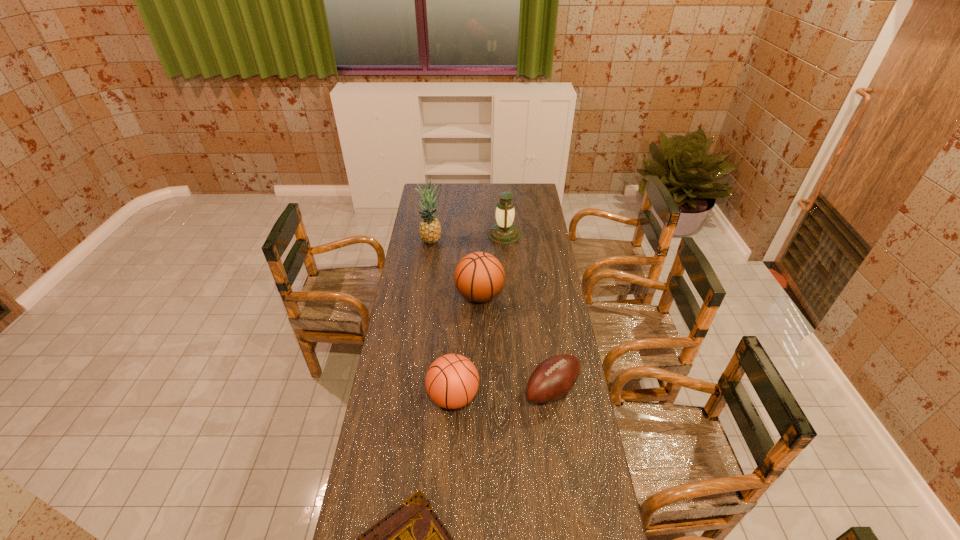
Locate an element on the screen. This screenshot has height=540, width=960. vacant point located on the right of the fourth nearest object is located at coordinates (536, 295).

You are a GUI agent. You are given a task and a screenshot of the screen. Output one action in this format:
    pyautogui.click(x=<x>, y=<y>)
    Task: Click on the vacant space located 0.100m on the back of the shorter basketball
    This screenshot has width=960, height=540.
    Given the screenshot: What is the action you would take?
    pyautogui.click(x=456, y=355)

This screenshot has width=960, height=540. Identify the location of blank space located on the back of the football (American). (541, 318).

At what (x,y) coordinates should I click in order to perform the action: click on object situated at the left edge. Please return your answer as a coordinate pair (x, y). The width and height of the screenshot is (960, 540). Looking at the image, I should click on (429, 228).

Locate an element on the screen. Image resolution: width=960 pixels, height=540 pixels. object that is at the right edge is located at coordinates (553, 378).

In the image, there is a desktop. Where is `vacant space at the far edge`? The image size is (960, 540). vacant space at the far edge is located at coordinates (511, 185).

Identify the location of blank space at the left edge. (368, 490).

Where is `blank space at the right edge`? The height and width of the screenshot is (540, 960). blank space at the right edge is located at coordinates (589, 454).

You are a GUI agent. You are given a task and a screenshot of the screen. Output one action in this format:
    pyautogui.click(x=<x>, y=<y>)
    Task: Click on the vacant position at the far right corner of the desktop
    The width and height of the screenshot is (960, 540).
    Given the screenshot: What is the action you would take?
    pyautogui.click(x=528, y=185)

Locate an element on the screen. free spot between the lantern and the shorter basketball is located at coordinates (479, 316).